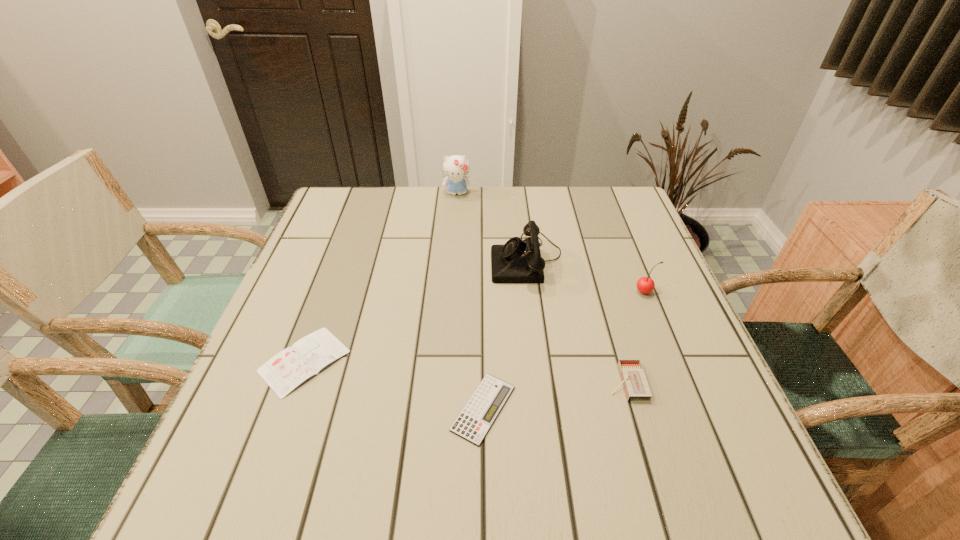
The height and width of the screenshot is (540, 960). Find the location of `vacant space located 0.080m on the front-facing side of the kitten`. vacant space located 0.080m on the front-facing side of the kitten is located at coordinates (455, 214).

What are the coordinates of `free space located on the front face of the second tallest object` in the screenshot? It's located at (377, 258).

You are a GUI agent. You are given a task and a screenshot of the screen. Output one action in this format:
    pyautogui.click(x=<x>, y=<y>)
    Task: Click on the vacant space located 0.100m on the front face of the second tallest object
    
    Given the screenshot: What is the action you would take?
    pyautogui.click(x=452, y=258)

The height and width of the screenshot is (540, 960). In order to click on vacant region located 0.180m on the front face of the second tallest object in this screenshot , I will do `click(420, 258)`.

This screenshot has width=960, height=540. Identify the location of vacant space located on the left of the cherry. (498, 292).

Locate an element on the screen. vacant space located 0.140m on the striking surface of the matchbox is located at coordinates (535, 383).

At what (x,y) coordinates should I click in order to perform the action: click on free space located 0.370m on the striking surface of the matchbox. Please return your answer as a coordinate pair (x, y). Looking at the image, I should click on (415, 383).

You are a GUI agent. You are given a task and a screenshot of the screen. Output one action in this format:
    pyautogui.click(x=<x>, y=<y>)
    Task: Click on the vacant point located on the striking surface of the matchbox
    
    Given the screenshot: What is the action you would take?
    pyautogui.click(x=582, y=383)

Find the location of a particular element. free space located 0.300m on the right of the diary is located at coordinates (497, 361).

Where is `vacant space located on the left of the calculator`? vacant space located on the left of the calculator is located at coordinates (368, 408).